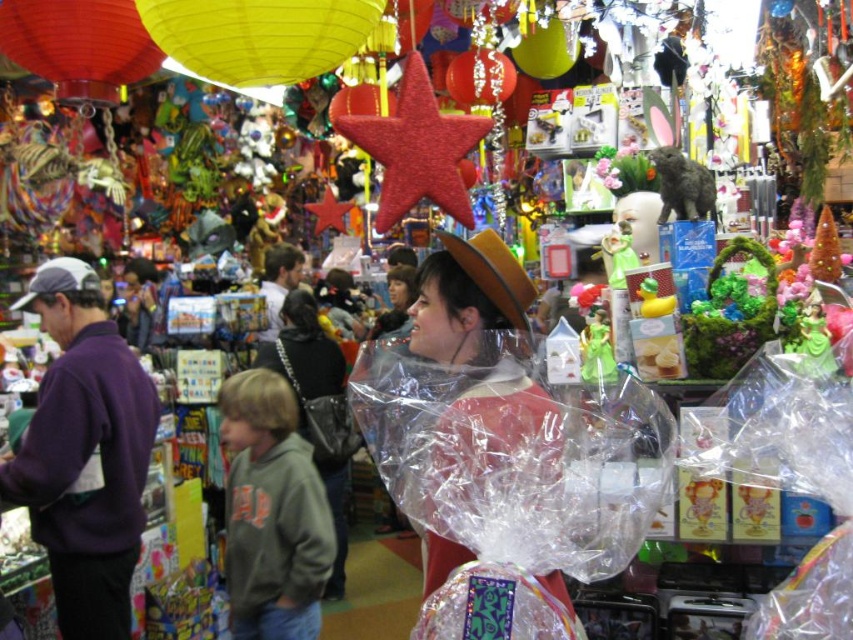
Question: Which point is closer to the camera?

Choices:
 (A) (328, 360)
 (B) (519, 320)
 (C) (140, 445)

Answer: (B)

Question: Can you confirm if purple fleece sweatshirt at left is smaller than matte black purse at center?

Choices:
 (A) yes
 (B) no

Answer: (A)

Question: Does purple fleece sweatshirt at left have a greater width compared to matte brown hat at center?

Choices:
 (A) yes
 (B) no

Answer: (A)

Question: Observing the image, what is the correct spatial positioning of matte brown hat at center in reference to matte black purse at center?

Choices:
 (A) below
 (B) above

Answer: (B)

Question: Among these points, which one is farthest from the camera?

Choices:
 (A) (79, 502)
 (B) (505, 307)
 (C) (308, 420)

Answer: (C)

Question: Among these points, which one is nearest to the camera?

Choices:
 (A) (334, 392)
 (B) (560, 600)

Answer: (B)